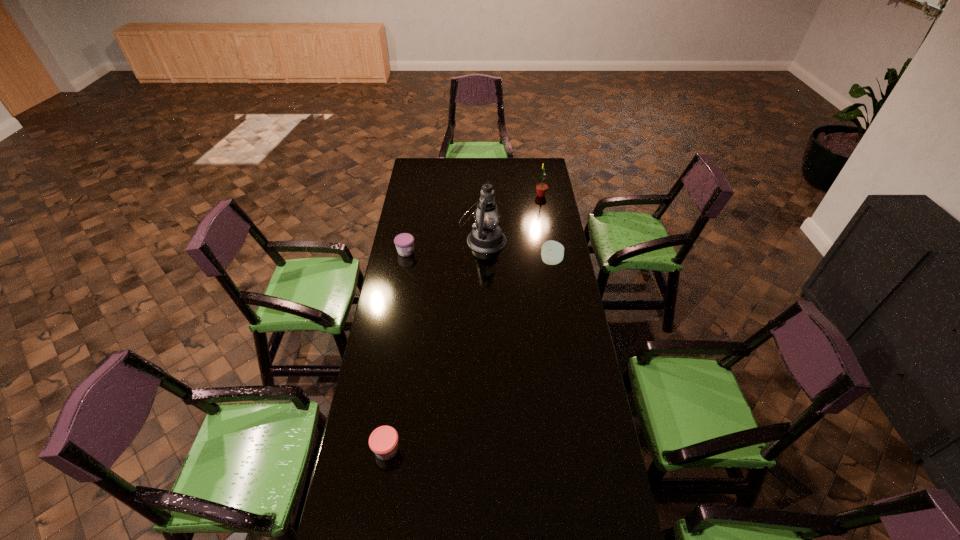
Where is `oil lamp`? The height and width of the screenshot is (540, 960). oil lamp is located at coordinates (486, 237).

You are a GUI agent. You are given a task and a screenshot of the screen. Output one action in this format:
    pyautogui.click(x=<x>, y=<y>)
    Task: Click on the third object from left to right
    Image resolution: width=960 pixels, height=540 pixels.
    Given the screenshot: What is the action you would take?
    click(x=486, y=237)

In order to click on the farthest object in this screenshot , I will do `click(541, 188)`.

You are a GUI agent. You are given a task and a screenshot of the screen. Output one action in this format:
    pyautogui.click(x=<x>, y=<y>)
    Task: Click on the sunflower
    Image resolution: width=960 pixels, height=540 pixels.
    Given the screenshot: What is the action you would take?
    pyautogui.click(x=541, y=188)

The image size is (960, 540). In order to click on the third tallest object in this screenshot , I will do `click(552, 252)`.

Identify the location of the farther jam. The height and width of the screenshot is (540, 960). (404, 242).

Identify the location of the nearest object. Image resolution: width=960 pixels, height=540 pixels. (383, 441).

Where is `vacant area situated 0.250m on the back of the oil lamp`? vacant area situated 0.250m on the back of the oil lamp is located at coordinates (483, 200).

Find the location of a particular element. This screenshot has width=960, height=540. free location located 0.350m on the face of the sunflower is located at coordinates (474, 195).

Image resolution: width=960 pixels, height=540 pixels. What are the coordinates of `vacant space situated on the face of the sunflower` in the screenshot? It's located at (521, 195).